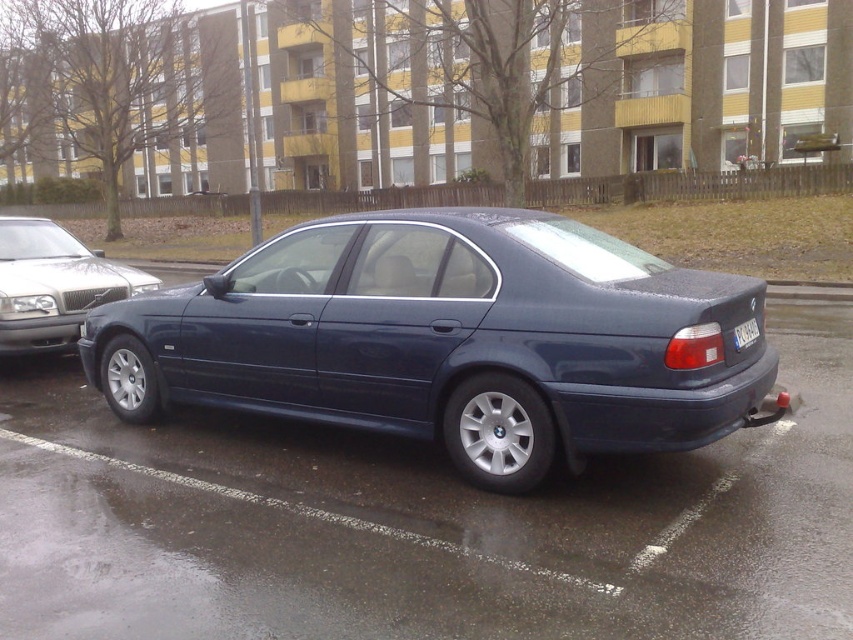
Question: Among these points, which one is farthest from the camera?

Choices:
 (A) (822, 637)
 (B) (741, 339)
 (C) (564, 417)

Answer: (B)

Question: Which point is farther from the camera taking this photo?

Choices:
 (A) (773, 362)
 (B) (757, 330)
 (C) (355, 552)
 (D) (61, 326)

Answer: (D)

Question: Is satin dark blue sedan at center to the left of black plastic license plate at rear from the viewer's perspective?

Choices:
 (A) no
 (B) yes

Answer: (A)

Question: Can you confirm if satin dark blue sedan at left is positioned below black plastic license plate at rear?

Choices:
 (A) yes
 (B) no

Answer: (B)

Question: Is glossy metallic car at center below black plastic license plate at rear?

Choices:
 (A) yes
 (B) no

Answer: (A)

Question: Which object is farther from the camera taking this photo?

Choices:
 (A) satin dark blue sedan at center
 (B) glossy metallic car at center

Answer: (A)